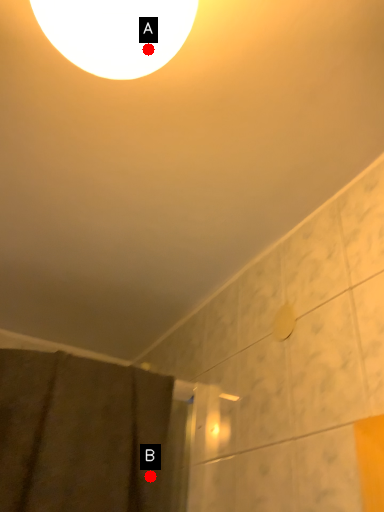
Question: Two points are circled on the image, labeled by A and B beside each circle. Which point is closer to the camera taking this photo?

Choices:
 (A) A is closer
 (B) B is closer

Answer: (A)